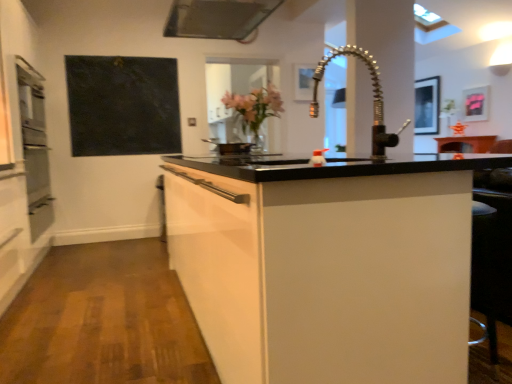
Question: Is white glossy cabinet at center in front of or behind black matte pan at center in the image?

Choices:
 (A) behind
 (B) front

Answer: (B)

Question: Considering the positions of white glossy cabinet at center and black matte pan at center in the image, is white glossy cabinet at center wider or thinner than black matte pan at center?

Choices:
 (A) thin
 (B) wide

Answer: (B)

Question: Considering the real-world distances, which object is closest to the black matte pan at center?

Choices:
 (A) black matte board at upper left
 (B) metallic silver exhaust hood at upper center
 (C) metallic silver picture frame at upper right, marked as the 2th picture frame in a front-to-back arrangement
 (D) white glossy cabinet at center
 (E) metallic silver picture frame at upper center, marked as the third picture frame in a back-to-front arrangement

Answer: (B)

Question: Which object is the closest to the black matte board at upper left?

Choices:
 (A) black matte pan at center
 (B) metallic silver picture frame at upper right, the third picture frame positioned from the left
 (C) metallic silver picture frame at upper center, the third picture frame positioned from the right
 (D) white glossy cabinet at center
 (E) metallic silver picture frame at upper right, the first picture frame in the back-to-front sequence

Answer: (A)